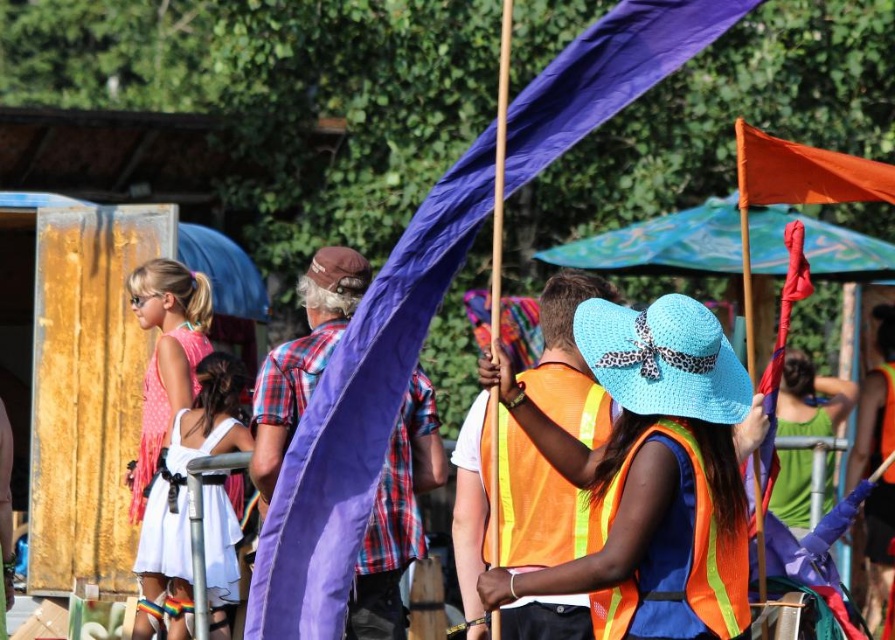
Question: Does plaid fabric shirt at center lie behind orange fabric flag at right?

Choices:
 (A) yes
 (B) no

Answer: (A)

Question: Is plaid fabric shirt at center bigger than neon orange safety vest at center?

Choices:
 (A) yes
 (B) no

Answer: (A)

Question: Which point is farther from the camera taking this photo?

Choices:
 (A) (788, 170)
 (B) (273, 397)
 (C) (891, 499)

Answer: (C)

Question: Which object is positioned farthest from the orange safety vest at center?

Choices:
 (A) orange fabric flag at right
 (B) orange fabric flag at upper right

Answer: (B)

Question: In this image, where is white satin dress at lower left located relative to orange fabric canopy at upper right?

Choices:
 (A) above
 (B) below

Answer: (B)

Question: Among these objects, which one is nearest to the camera?

Choices:
 (A) purple fabric flag at center
 (B) white satin dress at lower left
 (C) orange fabric flag at upper right

Answer: (A)